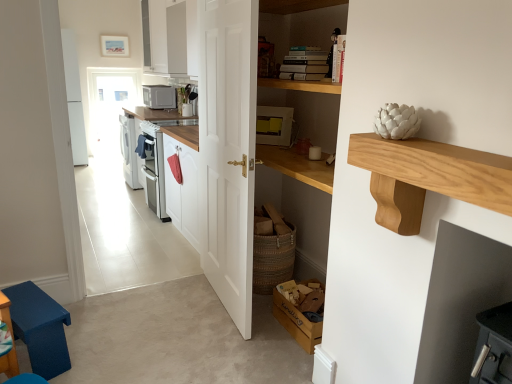
You are a GUI agent. You are given a task and a screenshot of the screen. Output one action in this format:
    pyautogui.click(x=<x>, y=<y>)
    Task: Click on the blue fabric step stool at lower left
    
    Given the screenshot: What is the action you would take?
    pyautogui.click(x=40, y=328)

What do you see at coordinates (428, 177) in the screenshot? I see `light wood shelf at upper right` at bounding box center [428, 177].

What do you see at coordinates (228, 150) in the screenshot? This screenshot has width=512, height=384. I see `white wooden door at center` at bounding box center [228, 150].

You are a GUI agent. You are given a task and a screenshot of the screen. Output one action in this format:
    pyautogui.click(x=<x>, y=<y>)
    Task: Click on the matte gray microwave at upper center, the 2th appliance when ordered from bottom to top
    This screenshot has height=384, width=512.
    Given the screenshot: What is the action you would take?
    pyautogui.click(x=159, y=96)

Considering the sizes of matte yellow appliance at center, which is the 1th appliance from front to back, and blue fabric step stool at lower left in the image, is matte yellow appliance at center, which is the 1th appliance from front to back, taller or shorter than blue fabric step stool at lower left?

Considering their sizes, matte yellow appliance at center, which is the 1th appliance from front to back, has less height than blue fabric step stool at lower left.

From a real-world perspective, is matte yellow appliance at center, which is the first appliance in right-to-left order, above or below blue fabric step stool at lower left?

Clearly, from a real-world perspective, matte yellow appliance at center, which is the first appliance in right-to-left order, is above blue fabric step stool at lower left.

Which object is positioned more to the right, matte yellow appliance at center, the first appliance ordered from the bottom, or blue fabric step stool at lower left?

matte yellow appliance at center, the first appliance ordered from the bottom.

Which of these two, light wood shelf at upper right or white glossy microwave at upper center, stands taller?

white glossy microwave at upper center is taller.

Is light wood shelf at upper right facing towards white glossy microwave at upper center?

No, light wood shelf at upper right is not aimed at white glossy microwave at upper center.

How distant is light wood shelf at upper right from white glossy microwave at upper center?

They are 4.62 meters apart.

Looking at this image, is light wood shelf at upper right in front of or behind white glossy microwave at upper center in the image?

light wood shelf at upper right is in front of white glossy microwave at upper center.

Is blue fabric step stool at lower left at the right side of light wood shelf at upper right?

Incorrect, blue fabric step stool at lower left is not on the right side of light wood shelf at upper right.

Is point (44, 337) in front of point (450, 176)?

That is False.

Is blue fabric step stool at lower left not close to light wood shelf at upper right?

Yes, blue fabric step stool at lower left and light wood shelf at upper right are quite far apart.

Does blue fabric step stool at lower left have a greater width compared to light wood shelf at upper right?

Yes.

What's the angular difference between light wood shelf at upper right and blue fabric step stool at lower left's facing directions?

The angle between the facing direction of light wood shelf at upper right and the facing direction of blue fabric step stool at lower left is 111 degrees.

Is light wood shelf at upper right not within blue fabric step stool at lower left?

Yes, light wood shelf at upper right is located beyond the bounds of blue fabric step stool at lower left.

Is light wood shelf at upper right far from blue fabric step stool at lower left?

Yes.

What are the coordinates of `step stool behind the light wood shelf at upper right` in the screenshot? It's located at (40, 328).

Based on the photo, from a real-world perspective, between matte yellow appliance at center, which is the 1th appliance from front to back, and white wooden door at center, who is vertically higher?

From a 3D spatial view, matte yellow appliance at center, which is the 1th appliance from front to back, is above.

From the image's perspective, which object appears higher, matte yellow appliance at center, which ranks as the second appliance in back-to-front order, or white wooden door at center?

From the image's view, matte yellow appliance at center, which ranks as the second appliance in back-to-front order, is above.

In terms of size, does matte yellow appliance at center, the 2th appliance positioned from the left, appear bigger or smaller than white wooden door at center?

In the image, matte yellow appliance at center, the 2th appliance positioned from the left, appears to be smaller than white wooden door at center.

Visually, is matte yellow appliance at center, the 2th appliance positioned from the left, positioned to the left or to the right of white wooden door at center?

In the image, matte yellow appliance at center, the 2th appliance positioned from the left, appears on the right side of white wooden door at center.

Which of these two, wooden cardboard box at lower center or matte yellow appliance at center, which is the first appliance in right-to-left order, is thinner?

matte yellow appliance at center, which is the first appliance in right-to-left order.

Consider the image. In terms of height, does wooden cardboard box at lower center look taller or shorter compared to matte yellow appliance at center, which ranks as the second appliance in back-to-front order?

Considering their sizes, wooden cardboard box at lower center has less height than matte yellow appliance at center, which ranks as the second appliance in back-to-front order.

Are wooden cardboard box at lower center and matte yellow appliance at center, the first appliance ordered from the bottom, making contact?

wooden cardboard box at lower center and matte yellow appliance at center, the first appliance ordered from the bottom, are not in contact.

Which is closer, (316, 328) or (273, 135)?

The point (316, 328) is more forward.

Would you say white glossy microwave at upper center contains blue fabric step stool at lower left?

Definitely not — blue fabric step stool at lower left is not inside white glossy microwave at upper center.

Are white glossy microwave at upper center and blue fabric step stool at lower left located far from each other?

white glossy microwave at upper center is positioned a significant distance from blue fabric step stool at lower left.

From a real-world perspective, is white glossy microwave at upper center located beneath blue fabric step stool at lower left?

No.

This screenshot has width=512, height=384. I want to click on corridor above the blue fabric step stool at lower left (from a real-world perspective), so click(116, 158).

The width and height of the screenshot is (512, 384). Find the location of `the 2nd appliance located above the blue fabric step stool at lower left (from a real-world perspective)`. the 2nd appliance located above the blue fabric step stool at lower left (from a real-world perspective) is located at coordinates (274, 125).

Locate an element on the screen. counter that is on the right side of white glossy microwave at upper center is located at coordinates (428, 177).

Based on their spatial positions, is matte yellow appliance at center, the 2th appliance positioned from the left, or blue fabric step stool at lower left further from light wood shelf at upper right?

Based on the image, blue fabric step stool at lower left appears to be further to light wood shelf at upper right.

When comparing their distances from matte gray microwave at upper center, which appears as the 2th appliance when viewed from the front, does white glossy microwave at upper center or white wooden door at center seem closer?

The object closer to matte gray microwave at upper center, which appears as the 2th appliance when viewed from the front, is white glossy microwave at upper center.

When comparing their distances from matte gray microwave at upper center, the 1th appliance when ordered from left to right, does matte yellow appliance at center, which is the 1th appliance from front to back, or light wood shelf at upper right seem closer?

matte yellow appliance at center, which is the 1th appliance from front to back, is positioned closer to the anchor matte gray microwave at upper center, the 1th appliance when ordered from left to right.

Looking at this image, looking at the image, which one is located closer to light wood shelf at upper right, matte gray microwave at upper center, the 2th appliance when ordered from bottom to top, or matte yellow appliance at center, which is the 1th appliance from front to back?

matte yellow appliance at center, which is the 1th appliance from front to back, is positioned closer to the anchor light wood shelf at upper right.

Looking at the image, which one is located further to wooden cardboard box at lower center, white wooden door at center or blue fabric step stool at lower left?

The object further to wooden cardboard box at lower center is blue fabric step stool at lower left.

Estimate the real-world distances between objects in this image. Which object is closer to blue fabric step stool at lower left, matte gray microwave at upper center, the 1th appliance when ordered from left to right, or white wooden door at center?

Among the two, white wooden door at center is located nearer to blue fabric step stool at lower left.

In the scene shown: Considering their positions, is matte yellow appliance at center, which is the first appliance in right-to-left order, positioned closer to blue fabric step stool at lower left than matte gray microwave at upper center, the 2th appliance when ordered from bottom to top?

Based on the image, matte yellow appliance at center, which is the first appliance in right-to-left order, appears to be nearer to blue fabric step stool at lower left.

From the image, which object appears to be farther from matte gray microwave at upper center, which appears as the 2th appliance when viewed from the front, matte yellow appliance at center, which ranks as the second appliance in back-to-front order, or wooden cardboard box at lower center?

Among the two, wooden cardboard box at lower center is located further to matte gray microwave at upper center, which appears as the 2th appliance when viewed from the front.

Identify the location of corridor located between white wooden door at center and matte gray microwave at upper center, the 1th appliance when ordered from left to right, in the depth direction. (116, 158).

Locate an element on the screen. appliance between white glossy microwave at upper center and matte gray microwave at upper center, acting as the second appliance starting from the right, along the z-axis is located at coordinates (274, 125).

At what (x,y) coordinates should I click in order to perform the action: click on corridor between blue fabric step stool at lower left and matte yellow appliance at center, acting as the 2th appliance starting from the top, from left to right. Please return your answer as a coordinate pair (x, y). The height and width of the screenshot is (384, 512). Looking at the image, I should click on (116, 158).

The image size is (512, 384). What are the coordinates of `door between blue fabric step stool at lower left and wooden cardboard box at lower center` in the screenshot? It's located at (228, 150).